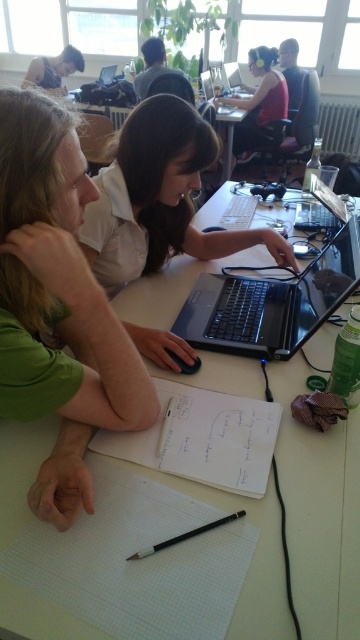
Does matte black laptop at center appear on the left side of matte black laptop at upper center?

In fact, matte black laptop at center is to the right of matte black laptop at upper center.

From the picture: Which is more to the right, matte black laptop at center or matte black laptop at upper center?

From the viewer's perspective, matte black laptop at center appears more on the right side.

Find the location of a particular element. The height and width of the screenshot is (640, 360). matte black laptop at center is located at coordinates (159, 198).

Is matte black laptop at upper center thinner than black matte pen at center?

In fact, matte black laptop at upper center might be wider than black matte pen at center.

Can you confirm if matte black laptop at upper center is wider than black matte pen at center?

Yes.

Who is more forward, (32, 77) or (231, 518)?

Point (231, 518) is in front.

Identify the location of matte black laptop at upper center. coord(54,68).

Based on the photo, who is more distant from viewer, [15,394] or [293,285]?

The point [293,285] is behind.

Who is shorter, green matte shirt at left or black plastic laptop at center?

black plastic laptop at center is shorter.

Locate an element on the screen. green matte shirt at left is located at coordinates (60, 301).

Locate an element on the screen. green matte shirt at left is located at coordinates (60, 301).